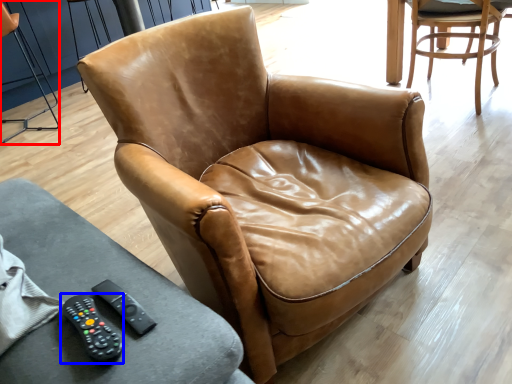
Question: Which point is further to the camera, chair (highlighted by a red box) or remote (highlighted by a blue box)?

Choices:
 (A) chair
 (B) remote

Answer: (A)